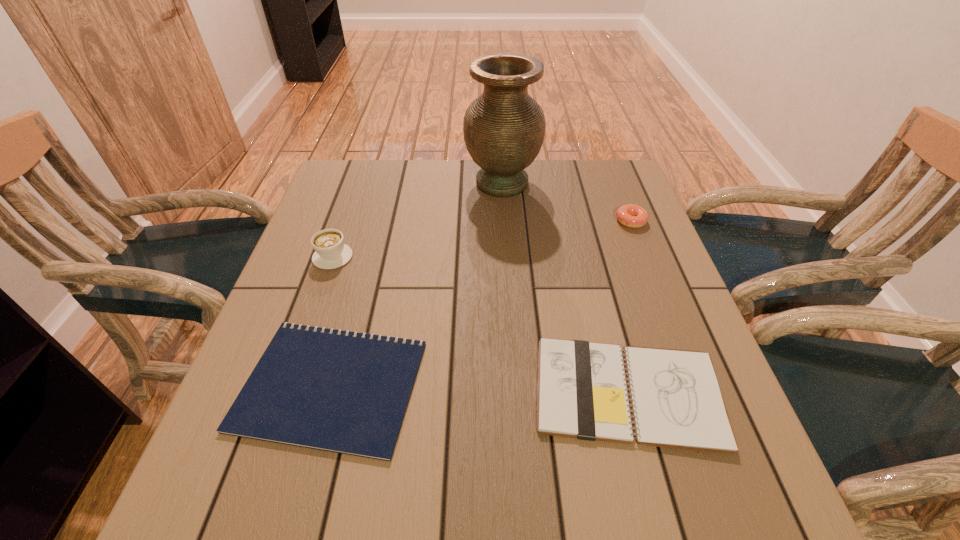
At what (x,y) coordinates should I click in order to perform the action: click on vase. Please return your answer as a coordinate pair (x, y). The width and height of the screenshot is (960, 540). Looking at the image, I should click on (504, 128).

You are a GUI agent. You are given a task and a screenshot of the screen. Output one action in this format:
    pyautogui.click(x=<x>, y=<y>)
    Task: Click on the farthest object
    
    Given the screenshot: What is the action you would take?
    pyautogui.click(x=504, y=128)

At what (x,y) coordinates should I click in order to perform the action: click on the fourth shortest object. Please return your answer as a coordinate pair (x, y). Looking at the image, I should click on (330, 252).

Image resolution: width=960 pixels, height=540 pixels. I want to click on cappuccino, so [330, 252].

At what (x,y) coordinates should I click in order to perform the action: click on the third shortest object. Please return your answer as a coordinate pair (x, y). The image size is (960, 540). Looking at the image, I should click on (633, 216).

Where is `doughnut`? Image resolution: width=960 pixels, height=540 pixels. doughnut is located at coordinates (633, 216).

Where is `the taller notepad`? Image resolution: width=960 pixels, height=540 pixels. the taller notepad is located at coordinates (676, 402).

Find the location of `the second shortest object`. the second shortest object is located at coordinates (676, 402).

Where is `the shortest object`? Image resolution: width=960 pixels, height=540 pixels. the shortest object is located at coordinates (332, 390).

At what (x,y) coordinates should I click in order to perform the action: click on the shorter notepad. Please return your answer as a coordinate pair (x, y). The image size is (960, 540). Looking at the image, I should click on (332, 390).